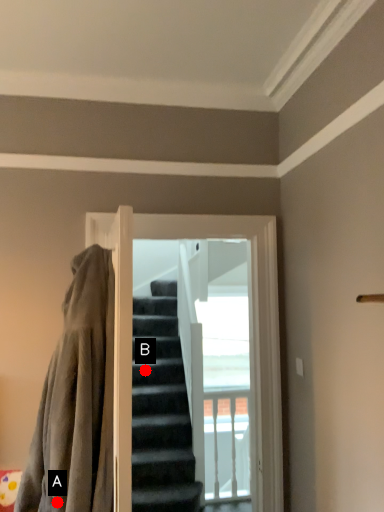
Question: Two points are circled on the image, labeled by A and B beside each circle. Which point is further to the camera?

Choices:
 (A) A is further
 (B) B is further

Answer: (B)